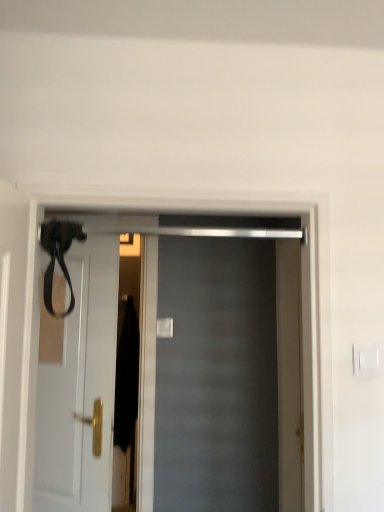
Question: Should I look upward or downward to see matte black door at center, positioned as the 1th door in front-to-back order?

Choices:
 (A) up
 (B) down

Answer: (B)

Question: Does matte black door at center, which is counted as the second door, starting from the left, have a larger size compared to white matte door at left, the 1th door when ordered from back to front?

Choices:
 (A) no
 (B) yes

Answer: (B)

Question: Considering the relative positions of matte black door at center, which is the 1th door in right-to-left order, and white matte door at left, which ranks as the second door in front-to-back order, in the image provided, is matte black door at center, which is the 1th door in right-to-left order, to the left of white matte door at left, which ranks as the second door in front-to-back order, from the viewer's perspective?

Choices:
 (A) no
 (B) yes

Answer: (A)

Question: Considering the relative sizes of matte black door at center, which is counted as the second door, starting from the left, and white matte door at left, placed as the 1th door when sorted from left to right, in the image provided, is matte black door at center, which is counted as the second door, starting from the left, taller than white matte door at left, placed as the 1th door when sorted from left to right,?

Choices:
 (A) yes
 (B) no

Answer: (B)

Question: From a real-world perspective, is matte black door at center, arranged as the 2th door when viewed from the back, on top of white matte door at left, marked as the 2th door in a right-to-left arrangement?

Choices:
 (A) no
 (B) yes

Answer: (B)

Question: Is matte black door at center, arranged as the 2th door when viewed from the back, thinner than white matte door at left, the 1th door when ordered from back to front?

Choices:
 (A) no
 (B) yes

Answer: (A)

Question: Does matte black door at center, positioned as the 1th door in front-to-back order, appear on the right side of white matte door at left, marked as the 2th door in a right-to-left arrangement?

Choices:
 (A) yes
 (B) no

Answer: (A)

Question: From a real-world perspective, is white matte door at left, which ranks as the second door in front-to-back order, positioned over matte black door at center, which is the 1th door in right-to-left order, based on gravity?

Choices:
 (A) yes
 (B) no

Answer: (B)

Question: Does white matte door at left, the 1th door when ordered from back to front, have a lesser height compared to matte black door at center, which is the 1th door in right-to-left order?

Choices:
 (A) no
 (B) yes

Answer: (A)

Question: From the image's perspective, does white matte door at left, marked as the 2th door in a right-to-left arrangement, appear lower than matte black door at center, arranged as the 2th door when viewed from the back?

Choices:
 (A) yes
 (B) no

Answer: (A)

Question: Is the surface of white matte door at left, the 1th door when ordered from back to front, in direct contact with matte black door at center, which is the 1th door in right-to-left order?

Choices:
 (A) yes
 (B) no

Answer: (B)

Question: Is matte black door at center, arranged as the 2th door when viewed from the back, a part of white matte door at left, the 1th door when ordered from back to front?

Choices:
 (A) yes
 (B) no

Answer: (B)

Question: Does white matte door at left, marked as the 2th door in a right-to-left arrangement, have a larger size compared to matte black door at center, positioned as the 1th door in front-to-back order?

Choices:
 (A) no
 (B) yes

Answer: (A)

Question: Considering the positions of white matte door at left, marked as the 2th door in a right-to-left arrangement, and matte black door at center, which is counted as the second door, starting from the left, in the image, is white matte door at left, marked as the 2th door in a right-to-left arrangement, bigger or smaller than matte black door at center, which is counted as the second door, starting from the left,?

Choices:
 (A) small
 (B) big

Answer: (A)